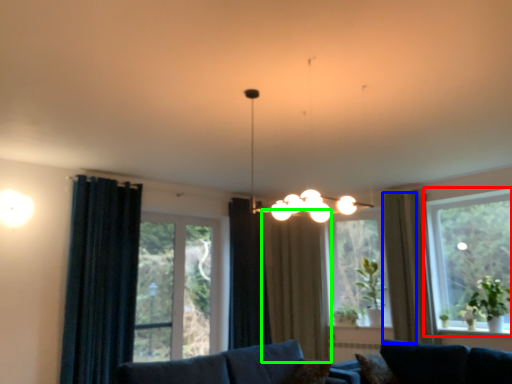
Question: Estimate the real-world distances between objects in this image. Which object is closer to window (highlighted by a red box), curtain (highlighted by a blue box) or curtain (highlighted by a green box)?

Choices:
 (A) curtain
 (B) curtain

Answer: (A)